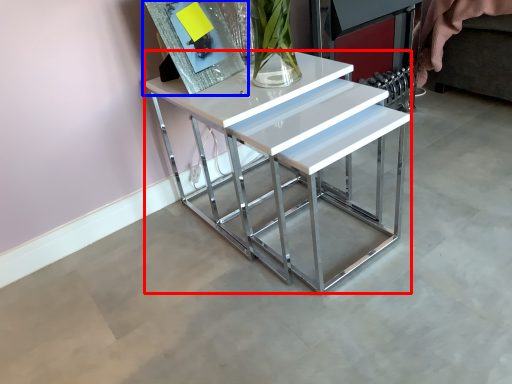
Question: Which point is further to the camera, table (highlighted by a red box) or picture frame (highlighted by a blue box)?

Choices:
 (A) table
 (B) picture frame

Answer: (B)